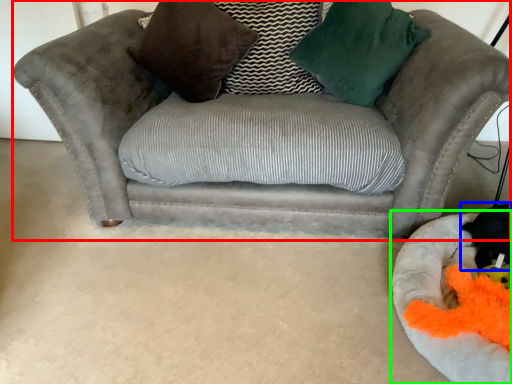
Question: Estimate the real-world distances between objects in this image. Which object is farther from studio couch (highlighted by a red box), animal (highlighted by a blue box) or dog bed (highlighted by a green box)?

Choices:
 (A) animal
 (B) dog bed

Answer: (A)